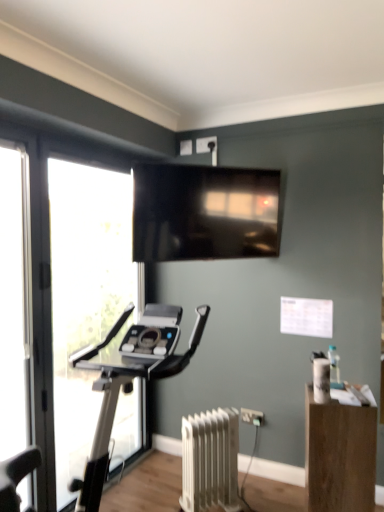
Question: Is matte black tv at upper center turned away from clear glass screen door at left?

Choices:
 (A) no
 (B) yes

Answer: (A)

Question: Is matte black tv at upper center at the right side of clear glass screen door at left?

Choices:
 (A) no
 (B) yes

Answer: (B)

Question: Considering the relative sizes of matte black tv at upper center and clear glass screen door at left in the image provided, is matte black tv at upper center bigger than clear glass screen door at left?

Choices:
 (A) no
 (B) yes

Answer: (B)

Question: Would you say matte black tv at upper center is outside clear glass screen door at left?

Choices:
 (A) yes
 (B) no

Answer: (A)

Question: From the image's perspective, is matte black tv at upper center on clear glass screen door at left?

Choices:
 (A) yes
 (B) no

Answer: (A)

Question: Is matte black tv at upper center next to clear glass screen door at left and touching it?

Choices:
 (A) yes
 (B) no

Answer: (B)

Question: Is wooden box at lower right shorter than white matte radiator at lower center?

Choices:
 (A) no
 (B) yes

Answer: (A)

Question: From a real-world perspective, is wooden box at lower right over white matte radiator at lower center?

Choices:
 (A) no
 (B) yes

Answer: (B)

Question: Can you confirm if wooden box at lower right is positioned to the right of white matte radiator at lower center?

Choices:
 (A) no
 (B) yes

Answer: (B)

Question: From the image's perspective, is wooden box at lower right located above white matte radiator at lower center?

Choices:
 (A) yes
 (B) no

Answer: (A)

Question: Is wooden box at lower right behind white matte radiator at lower center?

Choices:
 (A) yes
 (B) no

Answer: (B)

Question: Is wooden box at lower right not close to white matte radiator at lower center?

Choices:
 (A) yes
 (B) no

Answer: (B)

Question: From the image's perspective, is wooden box at lower right located beneath transparent glass window at left?

Choices:
 (A) no
 (B) yes

Answer: (B)